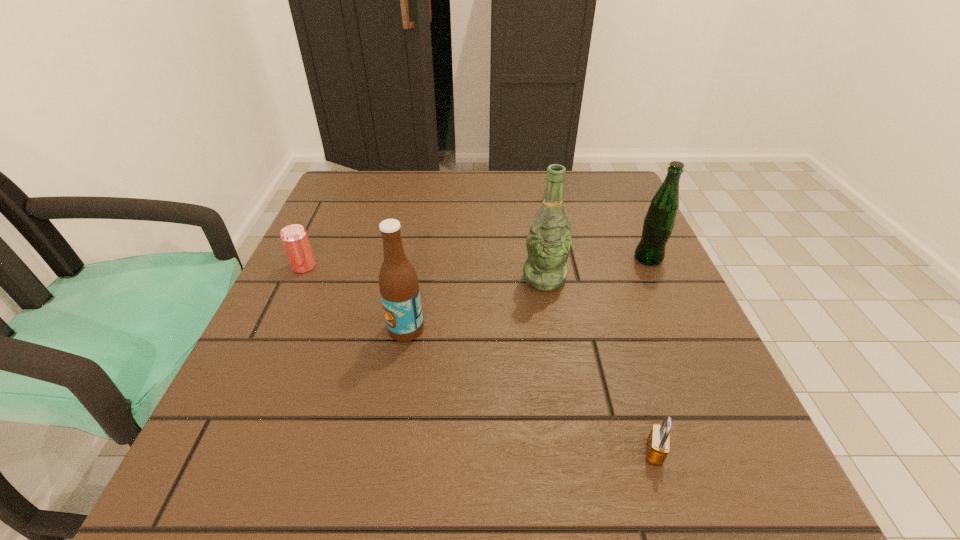
The width and height of the screenshot is (960, 540). Identify the location of free point between the third object from left to right and the padlock. (599, 366).

In order to click on vacant space that's between the third object from right to left and the beer can in this screenshot , I will do `click(424, 272)`.

The width and height of the screenshot is (960, 540). I want to click on vacant space in between the nearest beer bottle and the nearest object, so click(x=530, y=390).

In order to click on vacant area between the rightmost object and the second beer bottle from right to left in this screenshot , I will do [596, 268].

Where is `free space that is in between the second object from right to left and the beer can`? free space that is in between the second object from right to left and the beer can is located at coordinates (479, 359).

Select which object appears as the fourth closest to the beer can. Please provide its 2D coordinates. Your answer should be formatted as a tuple, i.e. [(x, y)], where the tuple contains the x and y coordinates of a point satisfying the conditions above.

[(658, 442)]

Locate which object is the third closest to the padlock. Please provide its 2D coordinates. Your answer should be formatted as a tuple, i.e. [(x, y)], where the tuple contains the x and y coordinates of a point satisfying the conditions above.

[(659, 222)]

Identify which beer bottle is the second closest to the second object from left to right. Please provide its 2D coordinates. Your answer should be formatted as a tuple, i.e. [(x, y)], where the tuple contains the x and y coordinates of a point satisfying the conditions above.

[(659, 222)]

The height and width of the screenshot is (540, 960). Find the location of `beer bottle object that ranks as the second closest to the rightmost beer bottle`. beer bottle object that ranks as the second closest to the rightmost beer bottle is located at coordinates (399, 288).

You are a GUI agent. You are given a task and a screenshot of the screen. Output one action in this format:
    pyautogui.click(x=<x>, y=<y>)
    Task: Click on the vacant region that satisfies the following two spatial constraints: 1. on the surface of the third object from left to right; 2. on the right side of the second object from right to left
    This screenshot has height=540, width=960.
    Given the screenshot: What is the action you would take?
    pyautogui.click(x=573, y=452)